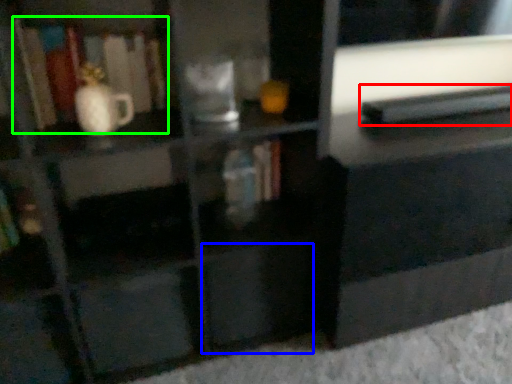
Question: Estimate the real-world distances between objects in this image. Which object is farther from book (highlighted by a red box), drawer (highlighted by a blue box) or book (highlighted by a green box)?

Choices:
 (A) drawer
 (B) book

Answer: (B)